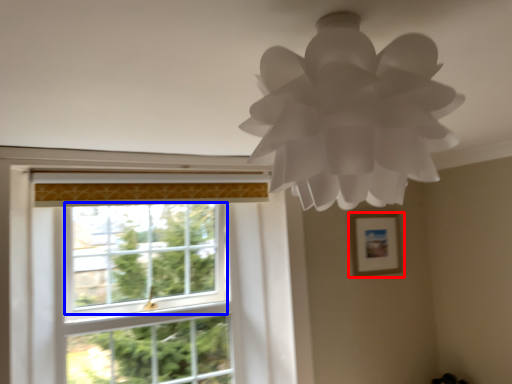
Question: Which point is further to the camera, picture frame (highlighted by a red box) or window screen (highlighted by a blue box)?

Choices:
 (A) picture frame
 (B) window screen

Answer: (A)